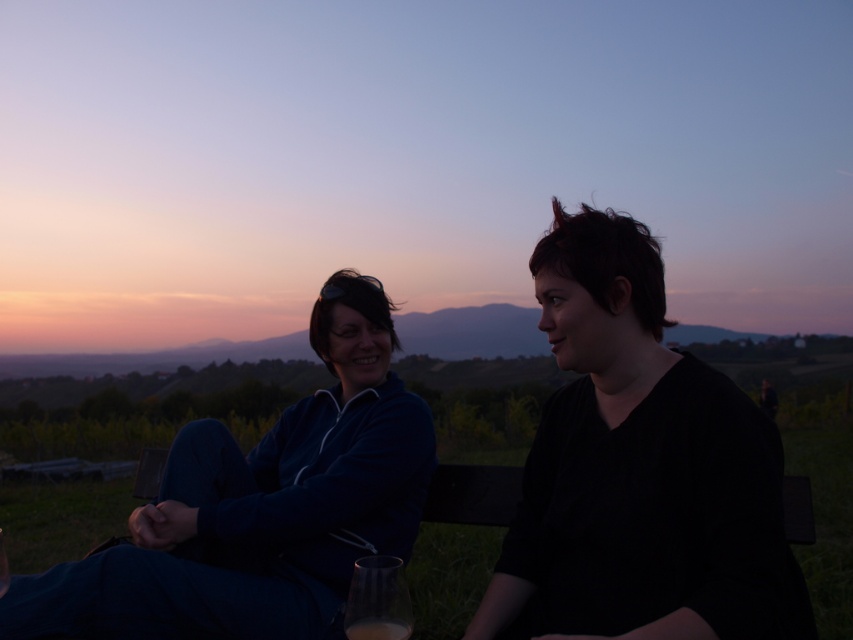
Is point (693, 636) more distant than point (405, 634)?

That is True.

Is the position of black matte shirt at center more distant than that of translucent glass at lower center?

Yes, it is behind translucent glass at lower center.

Who is more forward, [711,404] or [354,621]?

Point [354,621] is in front.

Locate an element on the screen. The width and height of the screenshot is (853, 640). black matte shirt at center is located at coordinates (637, 470).

Where is `matte blue jacket at left`? matte blue jacket at left is located at coordinates (260, 508).

Looking at this image, does matte blue jacket at left have a larger size compared to translucent glass at lower center?

Correct, matte blue jacket at left is larger in size than translucent glass at lower center.

Where is `matte blue jacket at left`? matte blue jacket at left is located at coordinates (260, 508).

Is dark blue jacket at center below matte blue jacket at left?

No, dark blue jacket at center is not below matte blue jacket at left.

Does point (340, 301) lie in front of point (386, 488)?

No, (340, 301) is further to viewer.

Who is more forward, [654,248] or [93,612]?

Positioned in front is point [654,248].

Where is `dark blue jacket at center`? dark blue jacket at center is located at coordinates (639, 470).